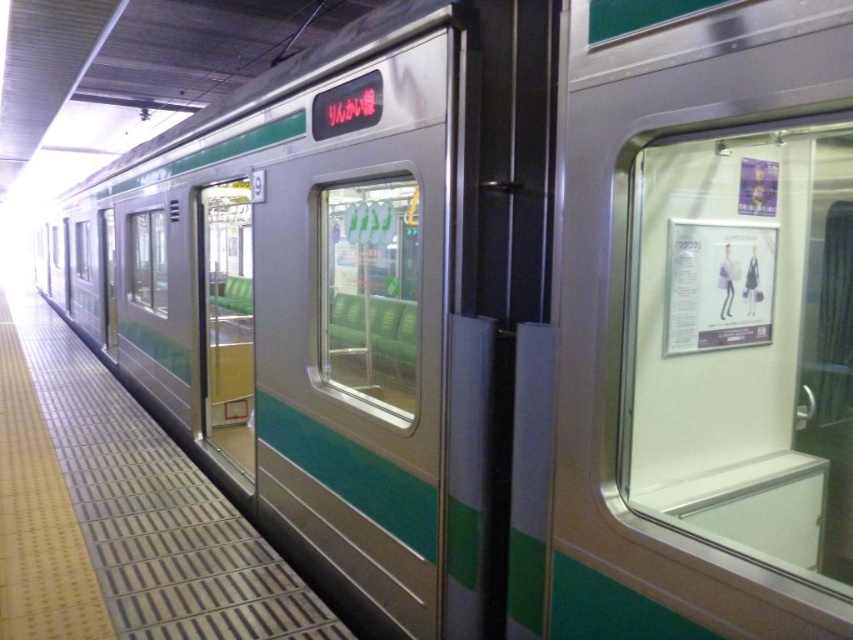
Does smooth concrete platform at center have a greater width compared to green matte door at center?

Indeed, smooth concrete platform at center has a greater width compared to green matte door at center.

Who is higher up, smooth concrete platform at center or green matte door at center?

green matte door at center is higher up.

Between point (231, 525) and point (200, 227), which one is positioned behind?

The point (200, 227) is behind.

You are a GUI agent. You are given a task and a screenshot of the screen. Output one action in this format:
    pyautogui.click(x=<x>, y=<y>)
    Task: Click on the smooth concrete platform at center
    Image resolution: width=853 pixels, height=640 pixels.
    Given the screenshot: What is the action you would take?
    pyautogui.click(x=152, y=508)